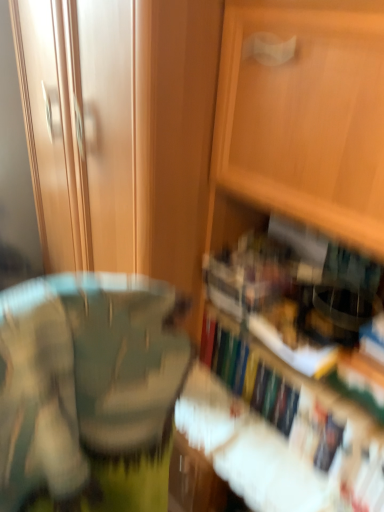
Question: From the image's perspective, is hardcover book at lower right under wooden cabinet at center?

Choices:
 (A) no
 (B) yes

Answer: (B)

Question: Does hardcover book at lower right turn towards wooden cabinet at center?

Choices:
 (A) no
 (B) yes

Answer: (B)

Question: Is hardcover book at lower right to the left of wooden cabinet at center from the viewer's perspective?

Choices:
 (A) no
 (B) yes

Answer: (A)

Question: Considering the relative sizes of hardcover book at lower right and wooden cabinet at center in the image provided, is hardcover book at lower right bigger than wooden cabinet at center?

Choices:
 (A) no
 (B) yes

Answer: (A)

Question: From a real-world perspective, does hardcover book at lower right stand above wooden cabinet at center?

Choices:
 (A) no
 (B) yes

Answer: (A)

Question: From a real-world perspective, is hardcover book at lower right physically below wooden cabinet at center?

Choices:
 (A) yes
 (B) no

Answer: (A)

Question: Considering the relative sizes of wooden cabinet at center and hardcover book at lower right in the image provided, is wooden cabinet at center thinner than hardcover book at lower right?

Choices:
 (A) yes
 (B) no

Answer: (B)

Question: Does wooden cabinet at center turn towards hardcover book at lower right?

Choices:
 (A) yes
 (B) no

Answer: (A)

Question: Is wooden cabinet at center positioned with its back to hardcover book at lower right?

Choices:
 (A) yes
 (B) no

Answer: (A)

Question: Considering the relative positions of wooden cabinet at center and hardcover book at lower right in the image provided, is wooden cabinet at center behind hardcover book at lower right?

Choices:
 (A) no
 (B) yes

Answer: (A)

Question: Is the depth of wooden cabinet at center less than that of hardcover book at lower right?

Choices:
 (A) no
 (B) yes

Answer: (B)

Question: Is wooden cabinet at center positioned beyond the bounds of hardcover book at lower right?

Choices:
 (A) no
 (B) yes

Answer: (B)

Question: From the image's perspective, is hardcover book at lower right located above or below wooden cabinet at center?

Choices:
 (A) above
 (B) below

Answer: (B)